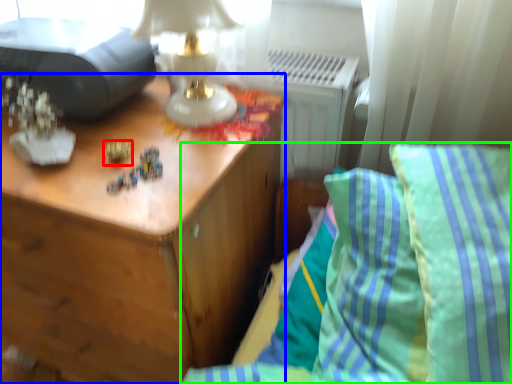
Question: Which is nearer to the toy (highlighted by a red box)? nightstand (highlighted by a blue box) or furniture (highlighted by a green box).

Choices:
 (A) nightstand
 (B) furniture

Answer: (A)